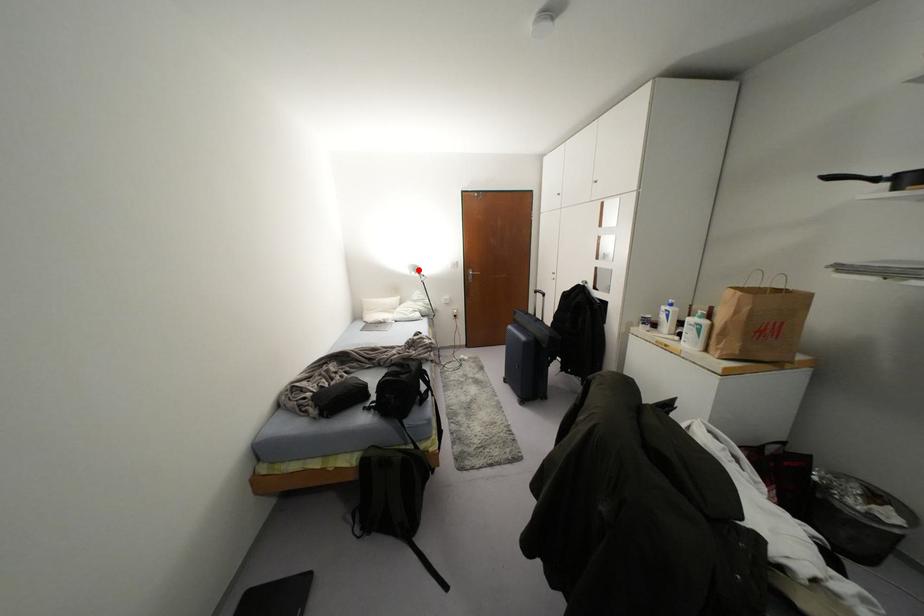
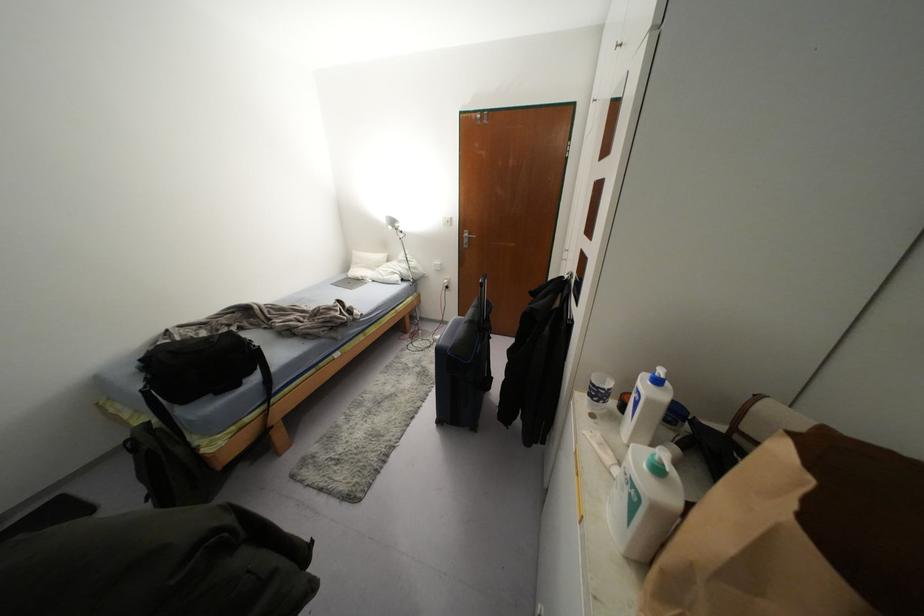
Locate, in the second image, the point that corresponds to the highlighted location in the first image.

(395, 225)